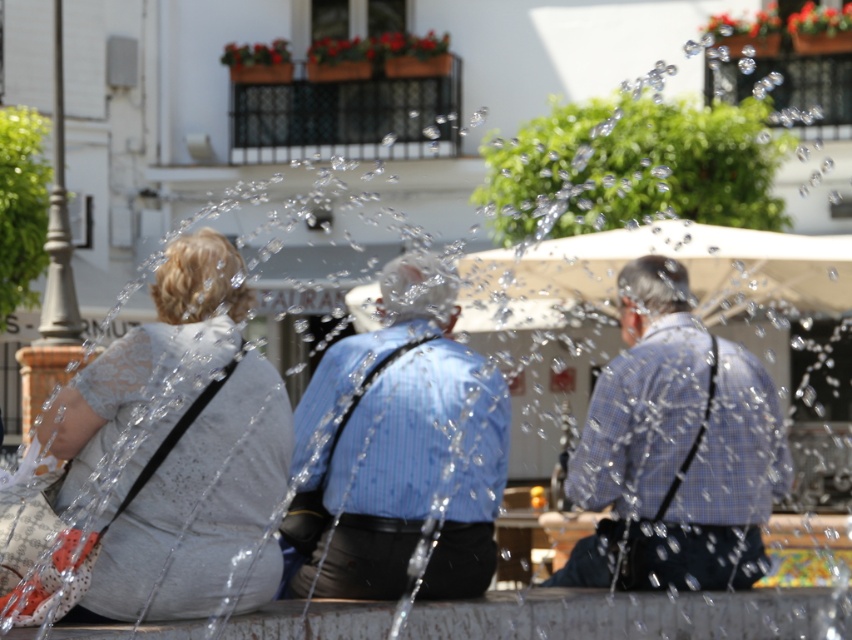
Question: Which object is farther from the camera taking this photo?

Choices:
 (A) blue checkered shirt at center
 (B) white dotted fabric at left

Answer: (A)

Question: Is the position of blue striped shirt at center more distant than that of blue checkered shirt at center?

Choices:
 (A) no
 (B) yes

Answer: (A)

Question: Does blue striped shirt at center lie behind blue checkered shirt at center?

Choices:
 (A) no
 (B) yes

Answer: (A)

Question: Based on their relative distances, which object is farther from the blue checkered shirt at center?

Choices:
 (A) white dotted fabric at left
 (B) blue striped shirt at center

Answer: (A)

Question: Considering the real-world distances, which object is closest to the blue striped shirt at center?

Choices:
 (A) blue checkered shirt at center
 (B) white dotted fabric at left

Answer: (A)

Question: Considering the relative positions of white dotted fabric at left and blue striped shirt at center in the image provided, where is white dotted fabric at left located with respect to blue striped shirt at center?

Choices:
 (A) below
 (B) above

Answer: (B)